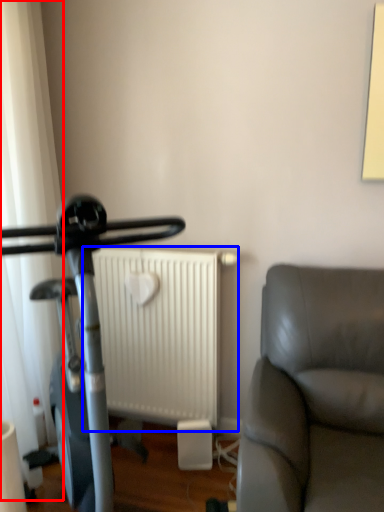
Question: Which of the following is the closest to the observer, curtain (highlighted by a red box) or radiator (highlighted by a blue box)?

Choices:
 (A) curtain
 (B) radiator

Answer: (A)